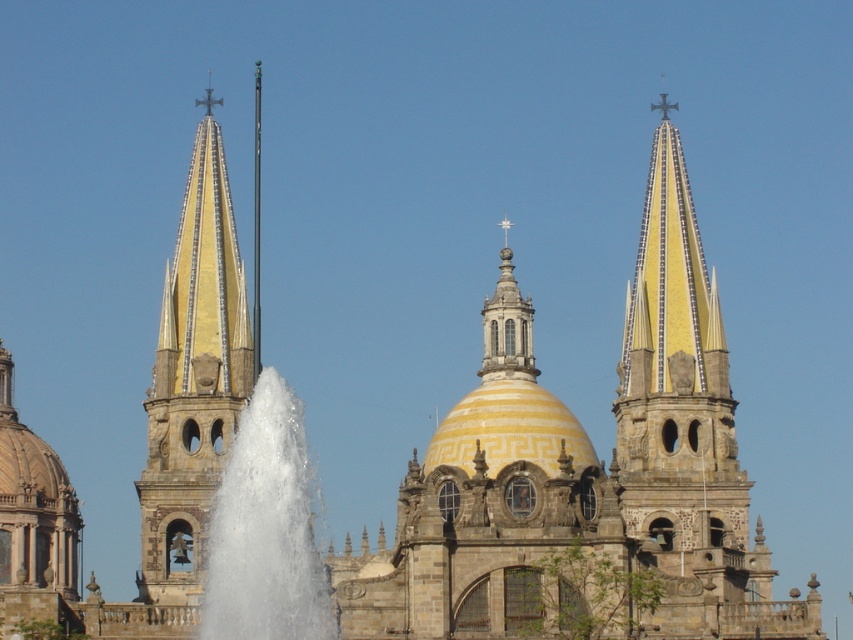
Question: Is yellow stone spire at upper right closer to camera compared to gold mosaic steeple at center?

Choices:
 (A) yes
 (B) no

Answer: (A)

Question: Which of the following is the closest to the observer?

Choices:
 (A) gold mosaic steeple at center
 (B) white frothy water at center
 (C) yellow stone spire at upper right

Answer: (B)

Question: Can you confirm if gold mosaic steeple at center is positioned above white frothy water at center?

Choices:
 (A) no
 (B) yes

Answer: (B)

Question: Does yellow stone spire at upper right come behind gold mosaic steeple at center?

Choices:
 (A) yes
 (B) no

Answer: (B)

Question: Which point appears farthest from the camera in this image?

Choices:
 (A) (653, 108)
 (B) (213, 428)
 (C) (242, 602)

Answer: (A)

Question: Which point appears farthest from the camera in this image?

Choices:
 (A) (229, 300)
 (B) (270, 499)
 (C) (666, 358)

Answer: (C)